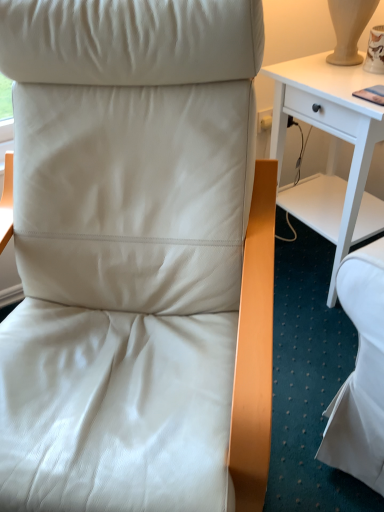
Question: In the image, is matte white leather chair at center positioned in front of or behind white wood desk at center?

Choices:
 (A) front
 (B) behind

Answer: (A)

Question: Considering the relative positions of matte white leather chair at center and white wood desk at center in the image provided, is matte white leather chair at center to the left or to the right of white wood desk at center?

Choices:
 (A) right
 (B) left

Answer: (B)

Question: Is matte white leather chair at center bigger or smaller than white wood desk at center?

Choices:
 (A) small
 (B) big

Answer: (B)

Question: From their relative heights in the image, would you say white wood desk at center is taller or shorter than matte white leather chair at center?

Choices:
 (A) tall
 (B) short

Answer: (B)

Question: From the image's perspective, relative to matte white leather chair at center, is white wood desk at center above or below?

Choices:
 (A) above
 (B) below

Answer: (A)

Question: Is white wood desk at center bigger or smaller than matte white leather chair at center?

Choices:
 (A) big
 (B) small

Answer: (B)

Question: From a real-world perspective, relative to matte white leather chair at center, is white wood desk at center vertically above or below?

Choices:
 (A) above
 (B) below

Answer: (B)